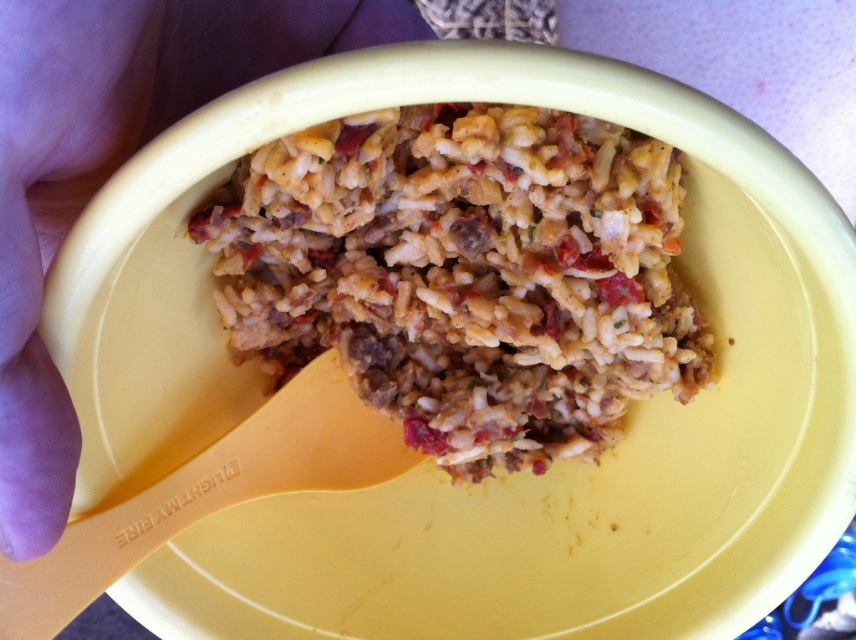
How far apart are light skin at left and yellow plastic spoon at lower left?

light skin at left is 6.37 inches away from yellow plastic spoon at lower left.

Is point (33, 93) in front of point (311, 369)?

Yes, it is in front of point (311, 369).

Where is `light skin at left`? The image size is (856, 640). light skin at left is located at coordinates (111, 170).

Who is positioned more to the left, brown matte rice at center or yellow plastic spoon at lower left?

yellow plastic spoon at lower left is more to the left.

Is point (375, 129) positioned in front of point (318, 452)?

Yes.

Which is in front, point (527, 348) or point (294, 401)?

Point (527, 348)

Locate an element on the screen. brown matte rice at center is located at coordinates click(x=467, y=275).

Can you confirm if brown matte rice at center is positioned to the right of light skin at left?

Yes, brown matte rice at center is to the right of light skin at left.

Between brown matte rice at center and light skin at left, which one has more height?

light skin at left is taller.

Identify the location of brown matte rice at center. (467, 275).